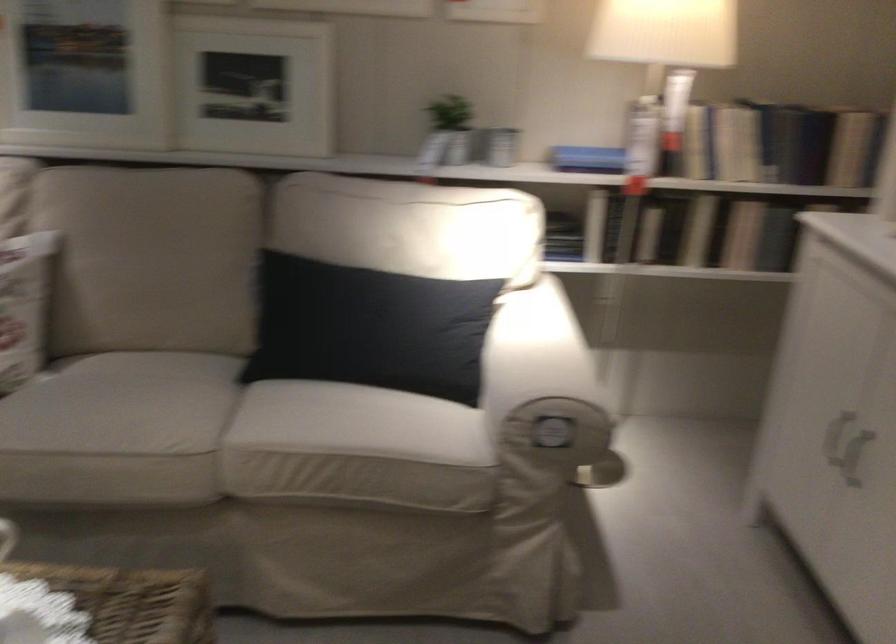
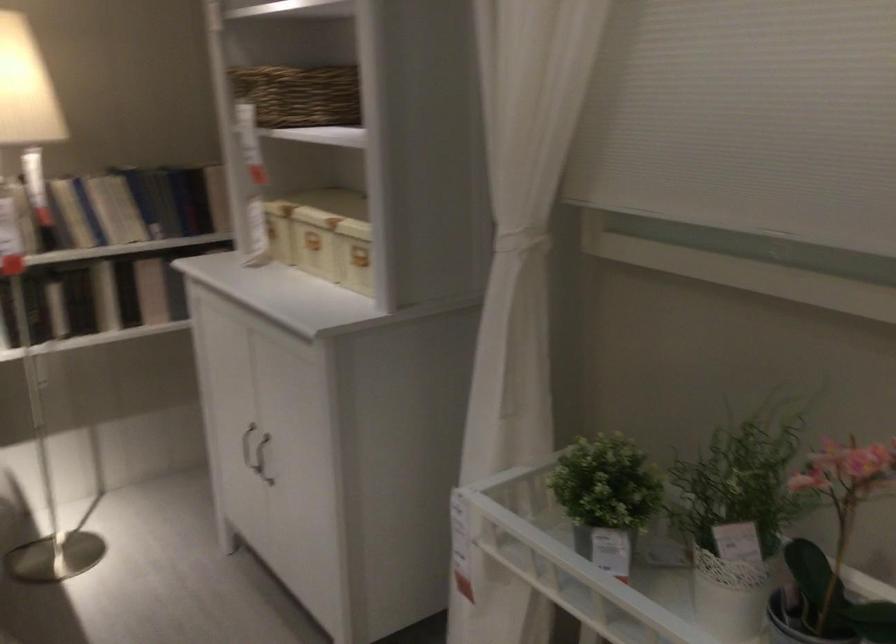
Question: Based on the continuous images, in which direction is the camera rotating? Reply with the corresponding letter.

Choices:
 (A) Left
 (B) Right
 (C) Up
 (D) Down

Answer: (B)